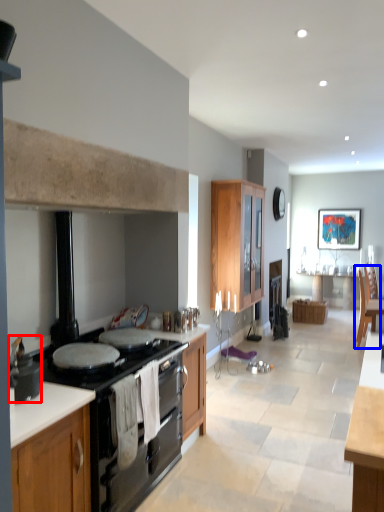
Question: Among these objects, which one is farthest to the camera, pot/pan (highlighted by a red box) or armchair (highlighted by a blue box)?

Choices:
 (A) pot/pan
 (B) armchair

Answer: (B)